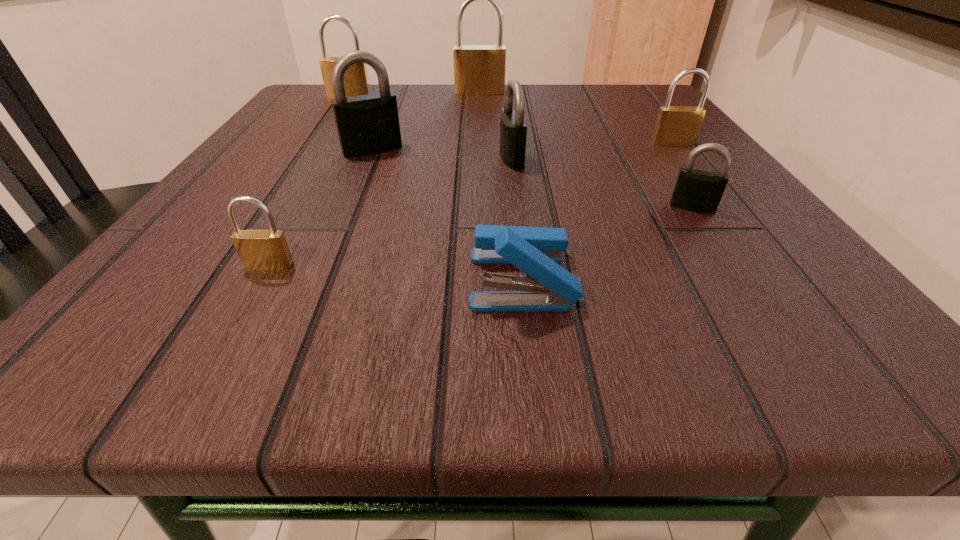
Find the location of a particular element. object located at the near edge is located at coordinates (546, 287).

The image size is (960, 540). I want to click on object located in the far left corner section of the desktop, so click(356, 83).

Where is `vacant area at the far edge`? This screenshot has height=540, width=960. vacant area at the far edge is located at coordinates (489, 111).

Find the location of `vacant space at the near edge of the desktop`. vacant space at the near edge of the desktop is located at coordinates (276, 327).

You are a GUI agent. You are given a task and a screenshot of the screen. Output one action in this format:
    pyautogui.click(x=<x>, y=<y>)
    Task: Click on the blank space at the left edge of the desktop
    
    Given the screenshot: What is the action you would take?
    pyautogui.click(x=275, y=158)

I want to click on vacant space at the right edge of the desktop, so click(605, 129).

In order to click on vacant space at the near left corner in this screenshot , I will do `click(181, 340)`.

At what (x,y) coordinates should I click in order to perform the action: click on blank space at the far right corner of the desktop. Please return your answer as a coordinate pair (x, y). Image resolution: width=960 pixels, height=540 pixels. Looking at the image, I should click on (631, 89).

At what (x,y) coordinates should I click in order to perform the action: click on free space at the near right corner of the desktop. Please return your answer as a coordinate pair (x, y). This screenshot has width=960, height=540. Looking at the image, I should click on (732, 306).

Locate an element on the screen. This screenshot has width=960, height=540. free space between the second biggest brass padlock and the nearest padlock is located at coordinates (309, 181).